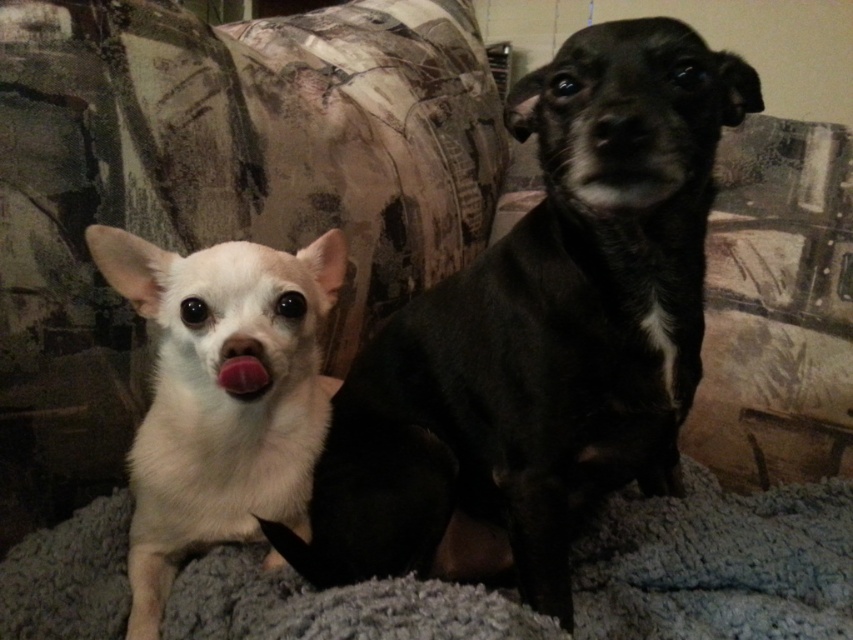
You are holding a small toy that is 12 inches long and want to place it on the spot marked by point [635,109]. Considering the distance from where you are standing, will the toy fit entirely within the area indicated by this point without overlapping any edges?

The point [635,109] is 22.47 inches from the viewer. Since the toy is only 12 inches long, it will fit entirely within the area indicated by this point without overlapping any edges as there is sufficient space.

You are a photographer setting up a shoot in the scene described. You need to place a small prop exactly at the center of the image. However, you must ensure that the prop does not overlap with the gray fluffy blanket at lower center. Given the coordinates provided, where should you place the prop to avoid the blanket?

The gray fluffy blanket at lower center is located at coordinates point (718,564). To avoid overlapping, place the prop away from this position, preferably closer to the upper half of the image where the blanket isn t present.